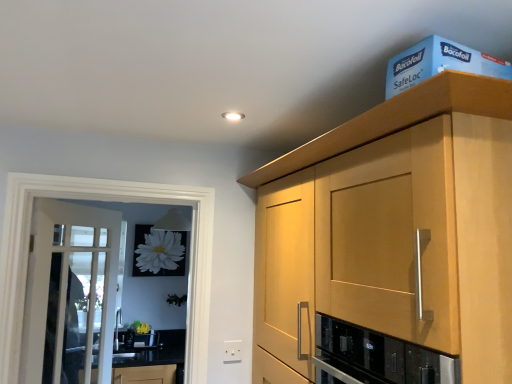
Question: Can you confirm if black glass oven at center is wider than white glass door at left?

Choices:
 (A) yes
 (B) no

Answer: (A)

Question: From a real-world perspective, is black glass oven at center on white glass door at left?

Choices:
 (A) yes
 (B) no

Answer: (B)

Question: From the image's perspective, is black glass oven at center below white glass door at left?

Choices:
 (A) no
 (B) yes

Answer: (A)

Question: Does black glass oven at center have a larger size compared to white glass door at left?

Choices:
 (A) no
 (B) yes

Answer: (A)

Question: From the image's perspective, is black glass oven at center on top of white glass door at left?

Choices:
 (A) no
 (B) yes

Answer: (B)

Question: Does black glass oven at center have a greater height compared to white glass door at left?

Choices:
 (A) yes
 (B) no

Answer: (B)

Question: Does white glass door at left have a greater height compared to white plastic electric outlet at lower center?

Choices:
 (A) no
 (B) yes

Answer: (B)

Question: Is white glass door at left facing away from white plastic electric outlet at lower center?

Choices:
 (A) yes
 (B) no

Answer: (B)

Question: Does white glass door at left have a lesser height compared to white plastic electric outlet at lower center?

Choices:
 (A) yes
 (B) no

Answer: (B)

Question: From a real-world perspective, is white glass door at left beneath white plastic electric outlet at lower center?

Choices:
 (A) yes
 (B) no

Answer: (B)

Question: Does white glass door at left turn towards white plastic electric outlet at lower center?

Choices:
 (A) no
 (B) yes

Answer: (B)

Question: Is white glass door at left bigger than white plastic electric outlet at lower center?

Choices:
 (A) yes
 (B) no

Answer: (A)

Question: Is light wood cabinet at upper right located outside blue cardboard box at upper right?

Choices:
 (A) no
 (B) yes

Answer: (B)